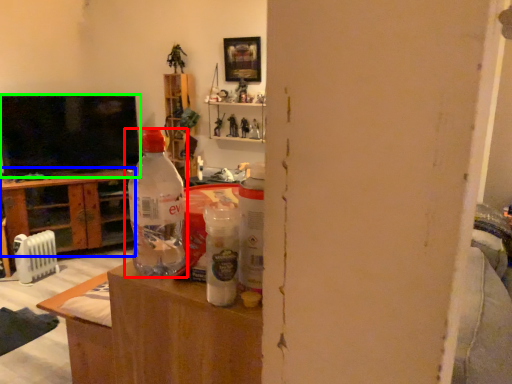
Question: Based on their relative distances, which object is nearer to bottle (highlighted by a red box)? Choose from cabinetry (highlighted by a blue box) and television (highlighted by a green box).

Choices:
 (A) cabinetry
 (B) television

Answer: (B)